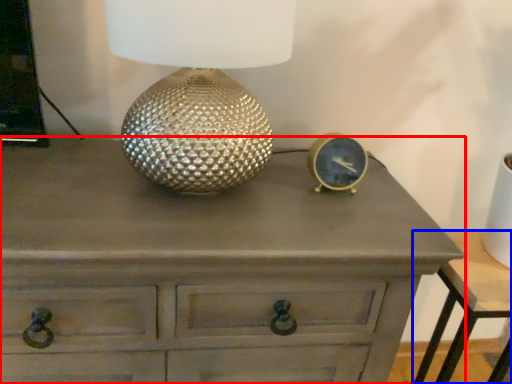
Question: Which object is closer to the camera taking this photo, chest of drawers (highlighted by a red box) or nightstand (highlighted by a blue box)?

Choices:
 (A) chest of drawers
 (B) nightstand

Answer: (A)